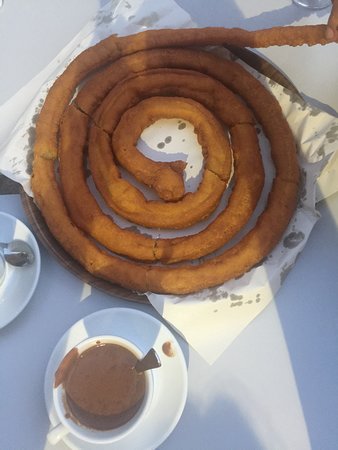
Find the location of `cup`. cup is located at coordinates (151, 391).